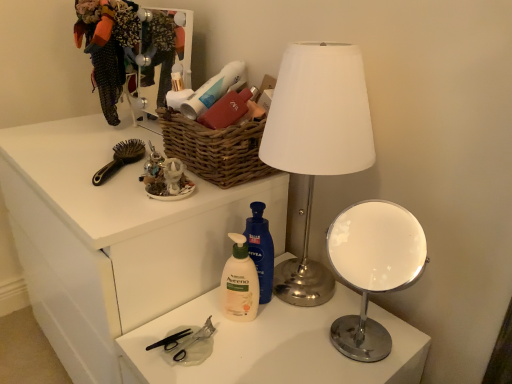
Locate an element on the screen. blank area to the left of white matte lotion at center, which appears as the 2th cleaning product when viewed from the right is located at coordinates (177, 326).